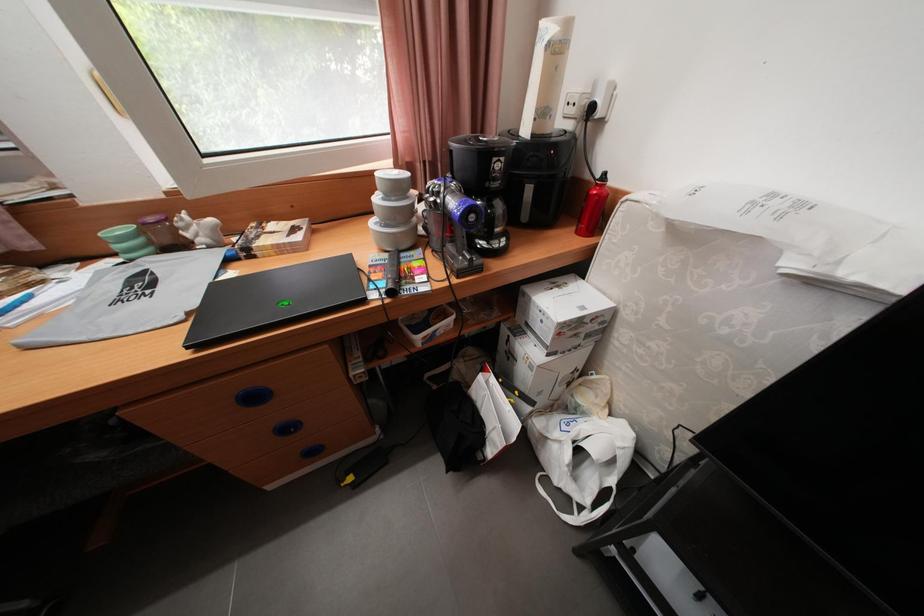
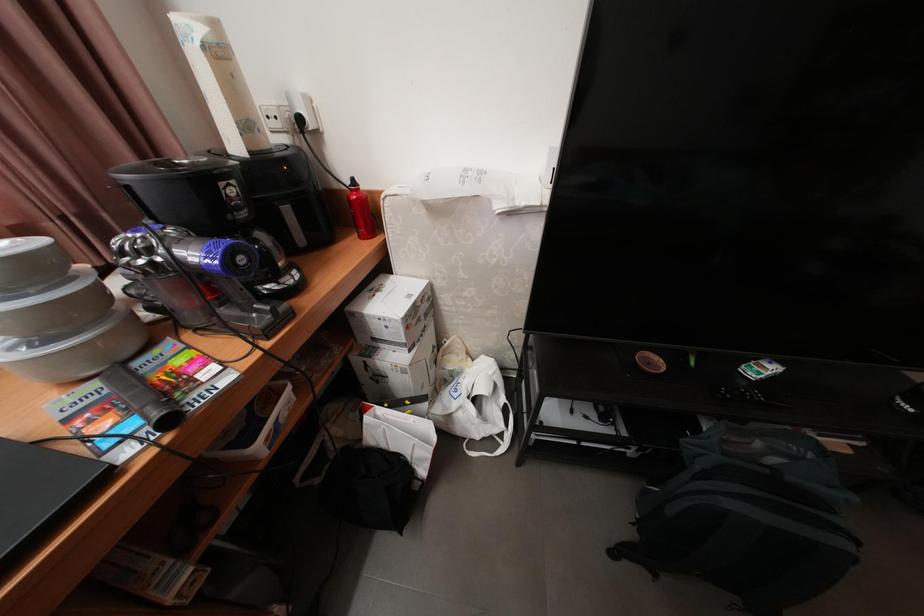
Question: How did the camera likely rotate?

Choices:
 (A) Left
 (B) Right
 (C) Up
 (D) Down

Answer: (B)